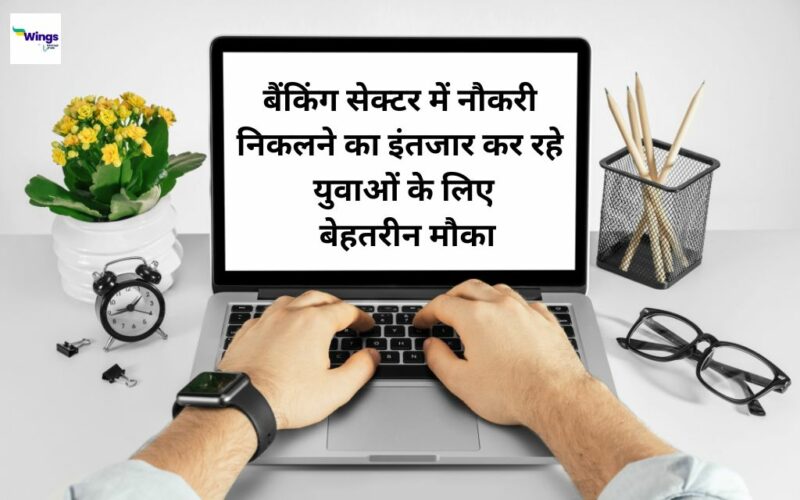
Where is `small black clock`? This screenshot has width=800, height=500. small black clock is located at coordinates (128, 286).